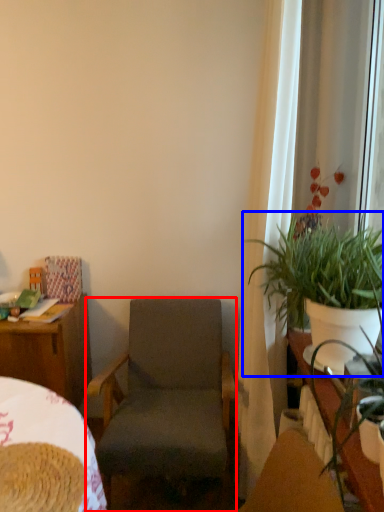
Question: Among these objects, which one is farthest to the camera, chair (highlighted by a red box) or houseplant (highlighted by a blue box)?

Choices:
 (A) chair
 (B) houseplant

Answer: (A)